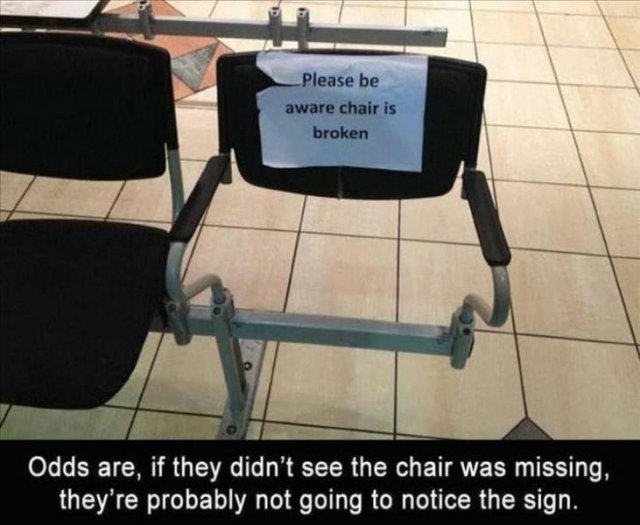
At what (x,y) coordinates should I click in order to perform the action: click on floor. Please return your answer as a coordinate pair (x, y). Looking at the image, I should click on (536, 256).